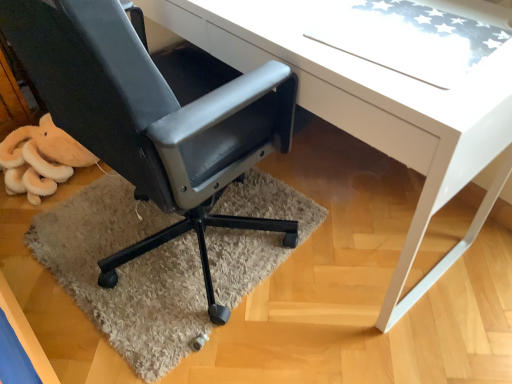
Question: Does point (230, 192) appear closer or farther from the camera than point (192, 36)?

Choices:
 (A) closer
 (B) farther

Answer: (B)

Question: In terms of size, does beige shaggy rug at lower left appear bigger or smaller than white glossy desk at center?

Choices:
 (A) big
 (B) small

Answer: (B)

Question: Which is nearer to the white glossy desk at center?

Choices:
 (A) beige shaggy rug at lower left
 (B) matte black office chair at lower left

Answer: (B)

Question: Estimate the real-world distances between objects in this image. Which object is farther from the matte black office chair at lower left?

Choices:
 (A) beige shaggy rug at lower left
 (B) white glossy desk at center

Answer: (A)